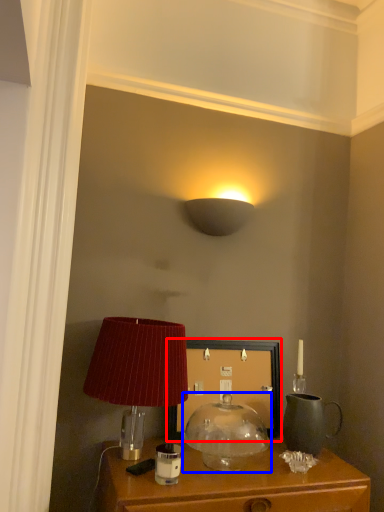
Question: Which of the following is the closest to the observer, picture frame (highlighted by a red box) or lamp (highlighted by a blue box)?

Choices:
 (A) picture frame
 (B) lamp

Answer: (B)